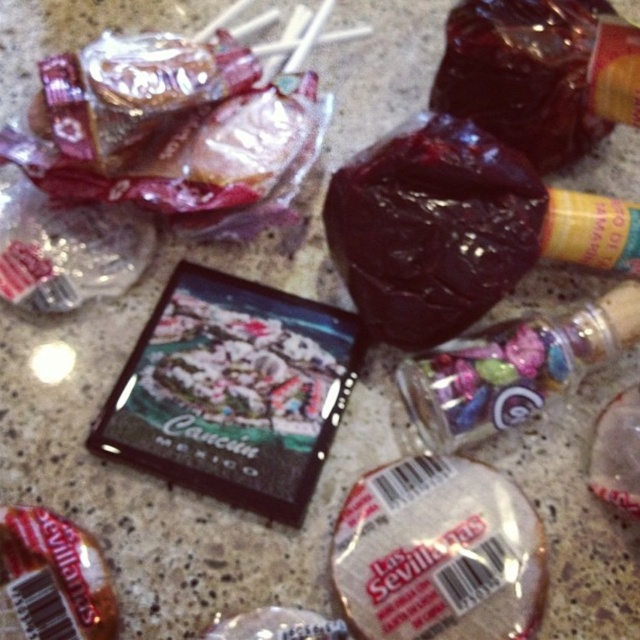
You are trying to place both the white matte cookie at center and the shiny dark red jelly at center into a gift box that can only fit items up to the size of the larger candy. Which candy should you place first to ensure both fit?

The white matte cookie at center is larger than the shiny dark red jelly at center. Place the white matte cookie at center first, then the shiny dark red jelly at center will fit into the remaining space.

You are a customer at a candy store and want to find the white matte cookie at center. Based on the coordinates provided, where should you look on the image to locate it?

The white matte cookie at center is located at the 2D coordinates point (438, 554) in the image.